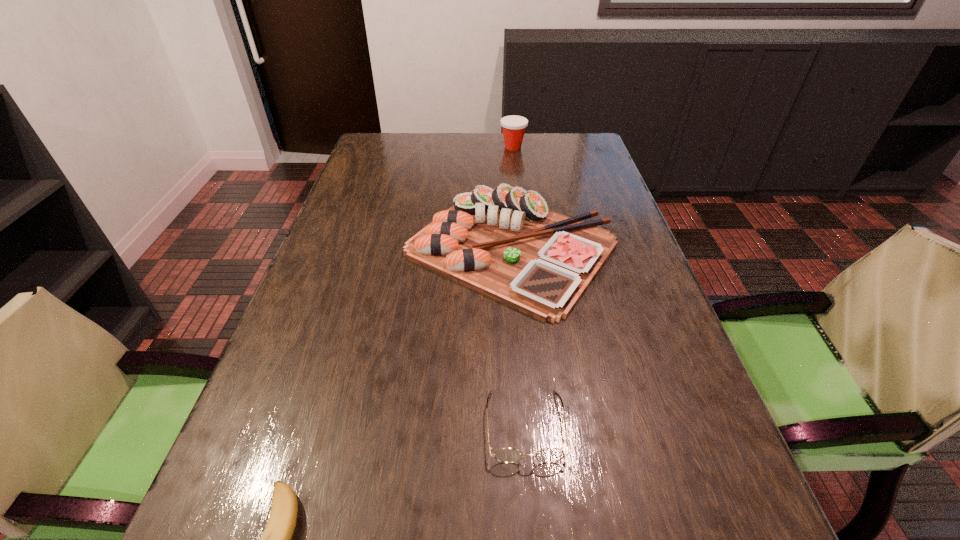
The width and height of the screenshot is (960, 540). Identify the location of blank space at the left edge. (346, 279).

Where is `vacant area at the right edge of the desktop`? Image resolution: width=960 pixels, height=540 pixels. vacant area at the right edge of the desktop is located at coordinates (609, 180).

Where is `free space at the far right corner of the desktop`? free space at the far right corner of the desktop is located at coordinates (549, 145).

Where is `vacant point located between the platter and the spectacles`? This screenshot has height=540, width=960. vacant point located between the platter and the spectacles is located at coordinates (518, 336).

I want to click on free space between the spectacles and the third shortest object, so click(518, 336).

Find the location of a particular element. empty location between the third shortest object and the spectacles is located at coordinates (518, 336).

Identify which object is the second closest to the Dixie cup. Please provide its 2D coordinates. Your answer should be formatted as a tuple, i.e. [(x, y)], where the tuple contains the x and y coordinates of a point satisfying the conditions above.

[(505, 455)]

Identify which object is the closest to the third nearest object. Please provide its 2D coordinates. Your answer should be formatted as a tuple, i.e. [(x, y)], where the tuple contains the x and y coordinates of a point satisfying the conditions above.

[(505, 455)]